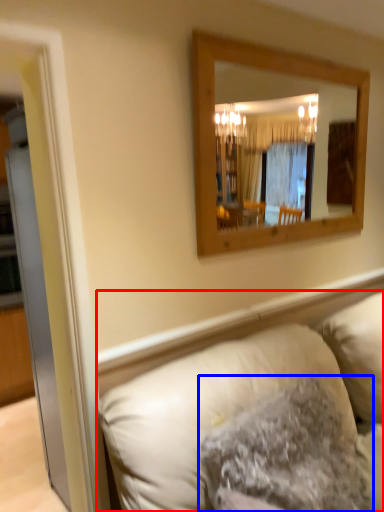
Question: Which of the following is the closest to the observer, studio couch (highlighted by a red box) or pillow (highlighted by a blue box)?

Choices:
 (A) studio couch
 (B) pillow

Answer: (A)